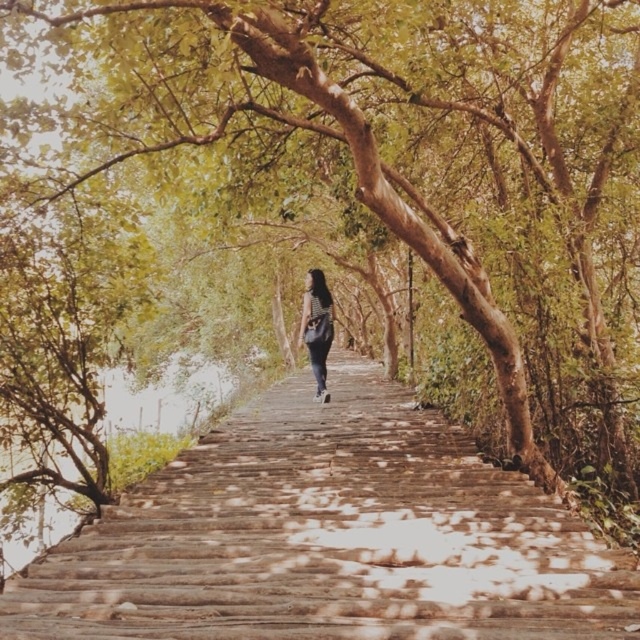
You are standing on the wooden pathway in the forest and see the wooden stairs at center and the striped fabric bag at center. Which object is nearer to you?

The wooden stairs at center is closer to the viewer than striped fabric bag at center.

You are standing at the starting point of the wooden pathway in the forest. You see two points marked on the path ahead of you. The first is at coordinate point (122, 522) and the second is at coordinate point (321, 312). Which point is closer to your current position?

Point (122, 522) is closer to the camera than point (321, 312), so the first point is closer to your current position.

You are standing at the entrance of the wooden pathway and want to reach the wooden stairs at center. Based on the 2D coordinates provided, in which direction should you walk to reach them?

The wooden stairs at center are located at coordinates point (x=330, y=538), so you should walk forward along the pathway towards the center to reach them.